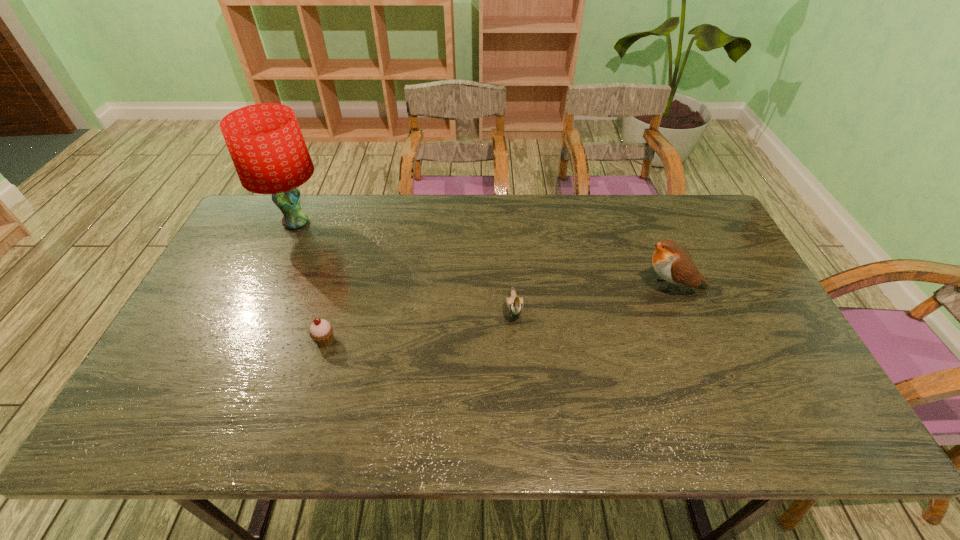
Find the location of a particular element. The image size is (960, 540). the farthest object is located at coordinates (265, 142).

Where is `the tallest object`? the tallest object is located at coordinates (265, 142).

Identify the location of the third shortest object. (673, 263).

Where is `the taller bird`? the taller bird is located at coordinates (673, 263).

Locate an element on the screen. This screenshot has height=540, width=960. the left bird is located at coordinates (514, 304).

Locate an element on the screen. The width and height of the screenshot is (960, 540). the shorter bird is located at coordinates coord(514,304).

Identify the location of the shortest object. Image resolution: width=960 pixels, height=540 pixels. (321, 331).

Image resolution: width=960 pixels, height=540 pixels. Find the location of `the third object from right to left`. the third object from right to left is located at coordinates (321, 331).

The image size is (960, 540). Identify the location of free spot located 0.140m on the front-facing side of the farthest object. click(x=273, y=275).

Locate an element on the screen. The height and width of the screenshot is (540, 960). vacant region located at the face of the rightmost object is located at coordinates (527, 286).